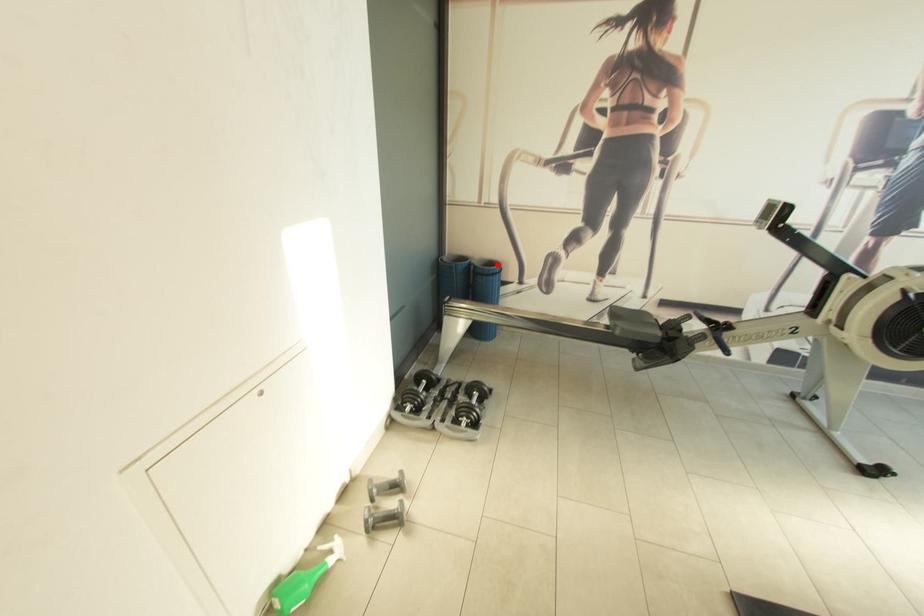
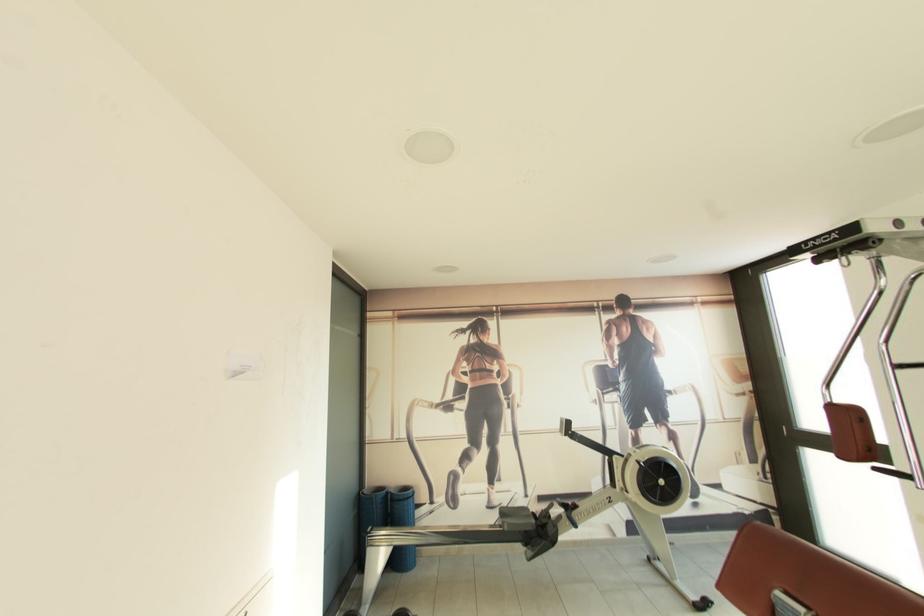
Question: A red point is marked in image1. In image2, is the corresponding 3D point closer to the camera or farther? Reply with the corresponding letter.

Choices:
 (A) The corresponding 3D point is closer.
 (B) The corresponding 3D point is farther.

Answer: (B)